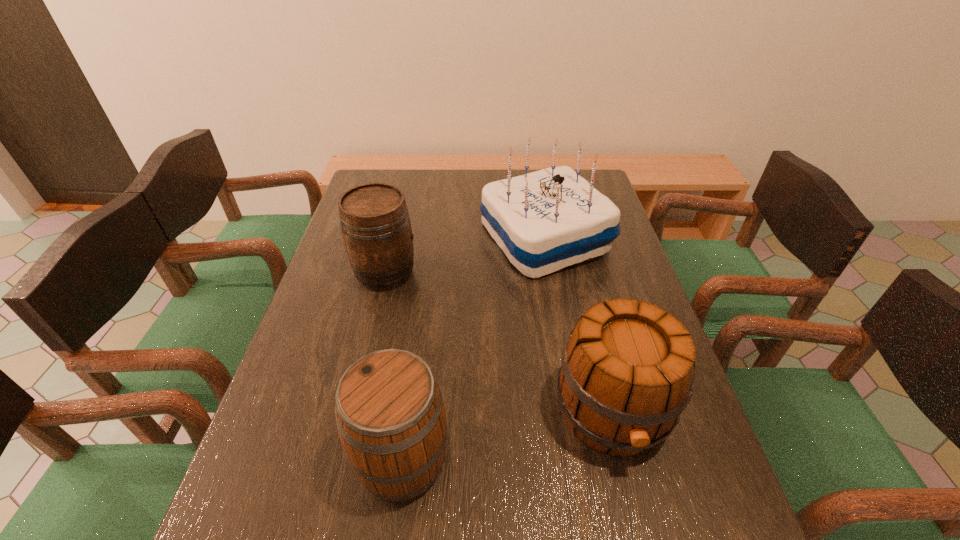
You are a GUI agent. You are given a task and a screenshot of the screen. Output one action in this format:
    pyautogui.click(x=<x>, y=<y>)
    Task: Click on the cider that stands as the second closest to the birthday cake
    This screenshot has width=960, height=540.
    Given the screenshot: What is the action you would take?
    pyautogui.click(x=627, y=373)

The width and height of the screenshot is (960, 540). In order to click on cider identified as the closest to the rightmost cider in this screenshot , I will do `click(390, 414)`.

Locate an element on the screen. The width and height of the screenshot is (960, 540). vacant space that satisfies the following two spatial constraints: 1. on the front side of the birthday cake; 2. on the side of the farthest cider near the bung hole is located at coordinates (551, 273).